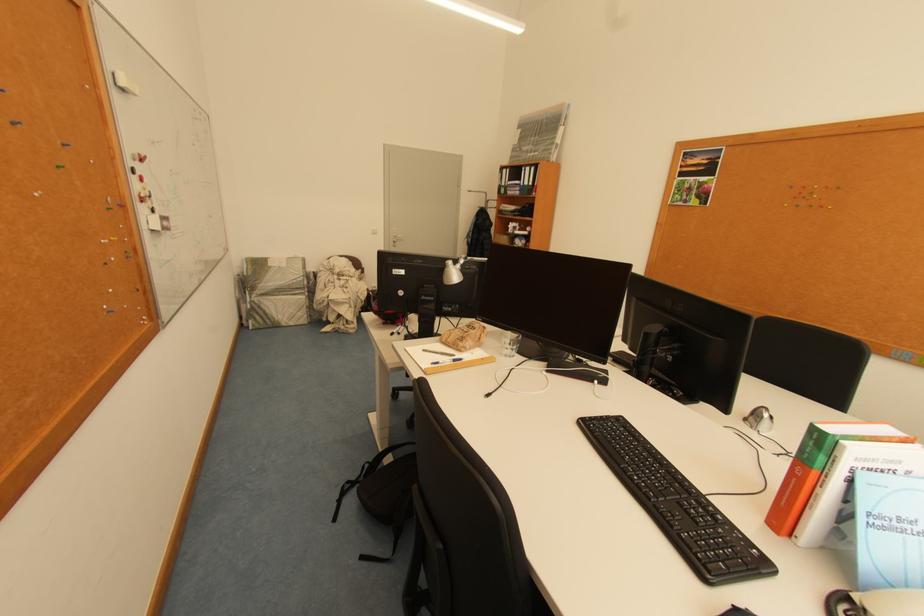
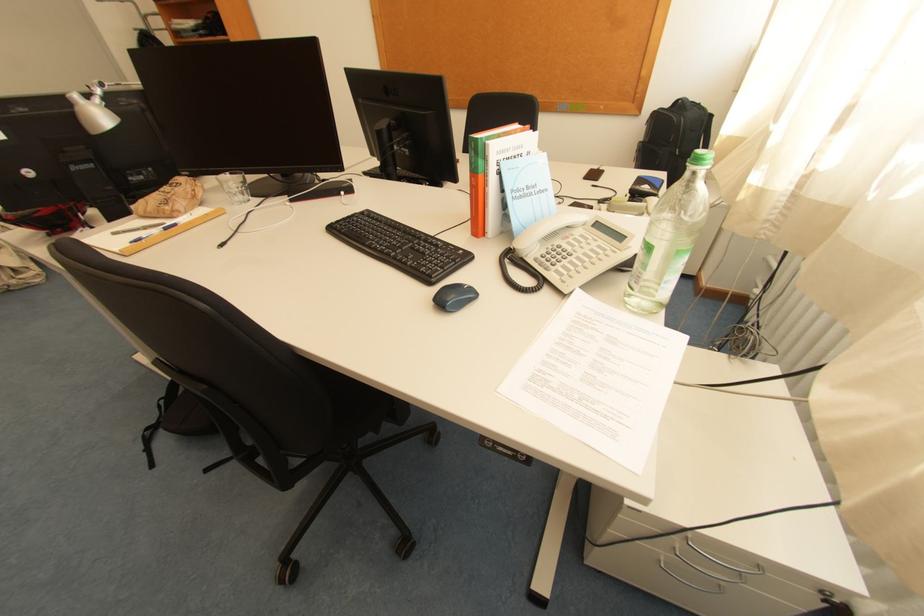
Where in the second image is the point corresponding to the point at 468,361 from the first image?

(184, 225)